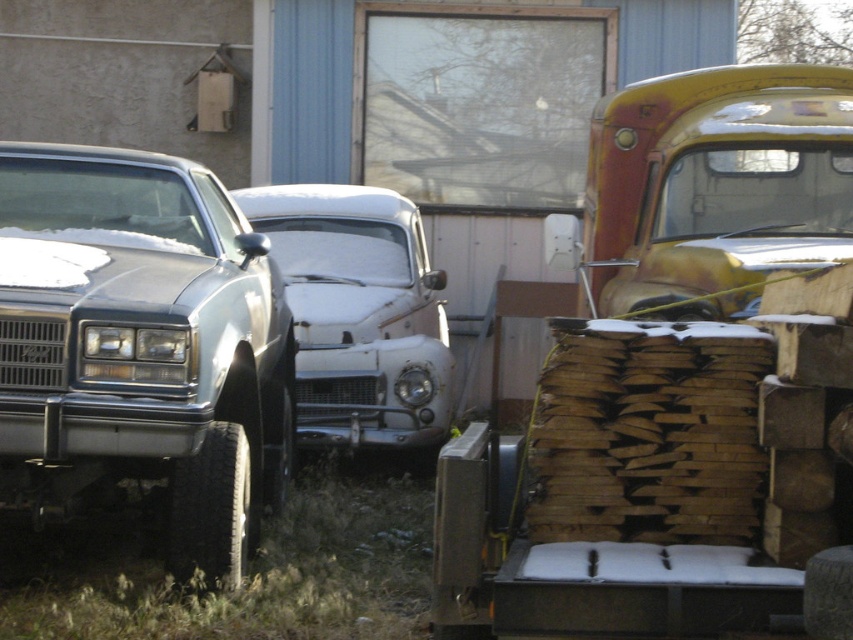
Between satin silver car at left and rusty metallic car at center, which one is positioned higher?

rusty metallic car at center is higher up.

Is satin silver car at left to the right of rusty metallic car at center from the viewer's perspective?

Incorrect, satin silver car at left is not on the right side of rusty metallic car at center.

The image size is (853, 640). What do you see at coordinates (142, 346) in the screenshot?
I see `satin silver car at left` at bounding box center [142, 346].

At what (x,y) coordinates should I click in order to perform the action: click on satin silver car at left. Please return your answer as a coordinate pair (x, y). This screenshot has width=853, height=640. Looking at the image, I should click on (142, 346).

How far apart are satin silver car at left and rusty metal truck at upper right?

2.48 meters

Between satin silver car at left and rusty metal truck at upper right, which one appears on the right side from the viewer's perspective?

From the viewer's perspective, rusty metal truck at upper right appears more on the right side.

Describe the element at coordinates (142, 346) in the screenshot. The width and height of the screenshot is (853, 640). I see `satin silver car at left` at that location.

Find the location of a particular element. Image resolution: width=853 pixels, height=640 pixels. satin silver car at left is located at coordinates (142, 346).

Based on the photo, does rusty metal truck at upper right have a lesser width compared to rusty metallic car at center?

Yes.

Which is in front, point (757, 214) or point (376, 356)?

Point (757, 214)

Is point (750, 275) positioned before point (430, 330)?

Yes, point (750, 275) is closer to viewer.

This screenshot has width=853, height=640. Identify the location of rusty metal truck at upper right. (717, 179).